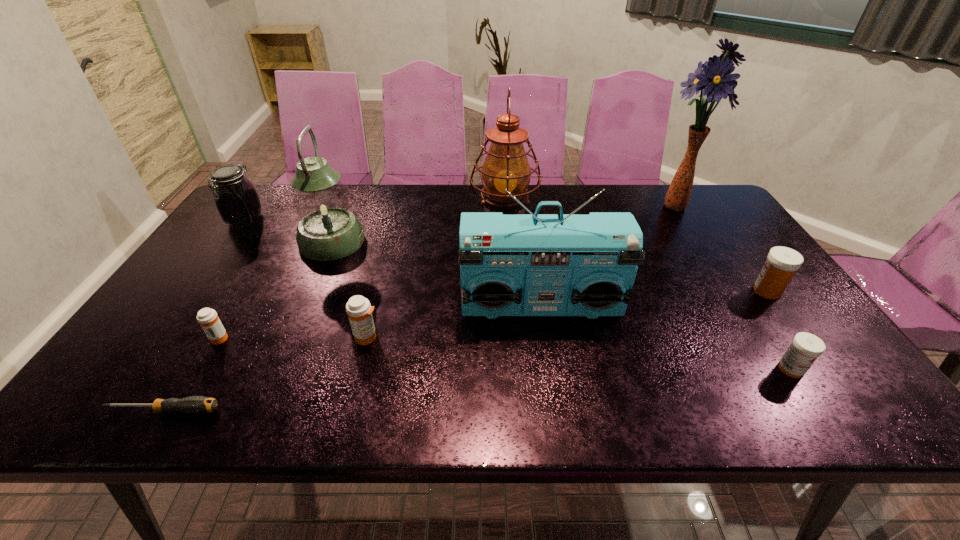
The image size is (960, 540). In order to click on jar present at the left edge in this screenshot , I will do `click(236, 199)`.

You are a GUI agent. You are given a task and a screenshot of the screen. Output one action in this format:
    pyautogui.click(x=<x>, y=<y>)
    Task: Click on the screwdriver located at the left edge
    
    Given the screenshot: What is the action you would take?
    pyautogui.click(x=194, y=404)

At what (x,y) coordinates should I click in order to perform the action: click on flower arrangement at the right edge. Please return your answer as a coordinate pair (x, y). Looking at the image, I should click on (715, 79).

At what (x,y) coordinates should I click in order to perform the action: click on object located in the far left corner section of the desktop. Please return your answer as a coordinate pair (x, y). Looking at the image, I should click on (236, 199).

Find the location of a particular element. This screenshot has width=960, height=540. object present at the near left corner is located at coordinates (194, 404).

I want to click on object located at the far right corner, so click(x=715, y=79).

In the image, there is a desktop. Identify the location of free space at the far edge. This screenshot has height=540, width=960. (441, 199).

In the image, there is a desktop. Where is `free region at the near edge`? The height and width of the screenshot is (540, 960). free region at the near edge is located at coordinates point(781,414).

This screenshot has width=960, height=540. What are the coordinates of `free region at the left edge of the desktop` in the screenshot? It's located at (156, 315).

The width and height of the screenshot is (960, 540). In the image, there is a desktop. Identify the location of free space at the right edge. (785, 310).